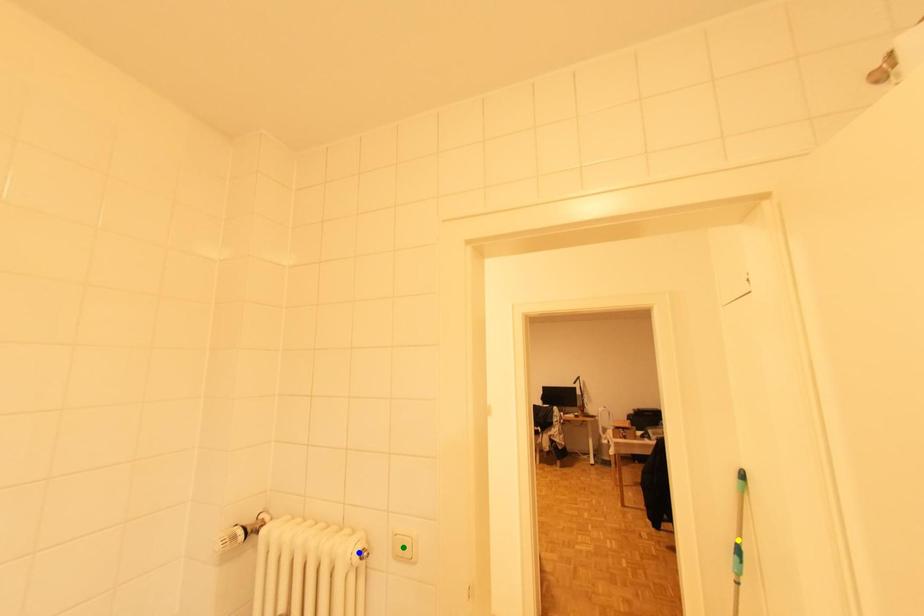
Order these from nearest to farthest:
blue point, green point, yellow point

blue point < green point < yellow point